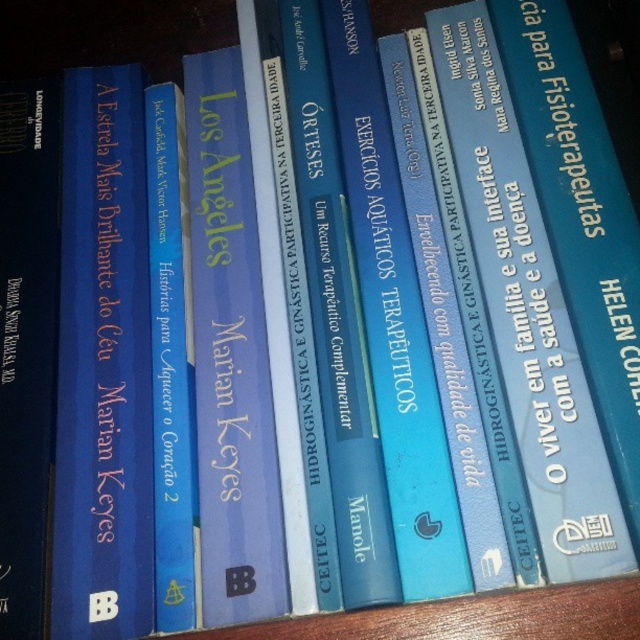
Question: Can you confirm if blue hardcover book at left is thinner than matte blue book at center?

Choices:
 (A) no
 (B) yes

Answer: (A)

Question: Which point is farther to the camera?

Choices:
 (A) (244, 580)
 (B) (100, 464)

Answer: (B)

Question: Is matte blue book at center behind blue hardcover book at center?

Choices:
 (A) yes
 (B) no

Answer: (A)

Question: Does blue hardcover book at left appear over blue hardcover book at center?

Choices:
 (A) no
 (B) yes

Answer: (A)

Question: Among these objects, which one is farthest from the camera?

Choices:
 (A) blue hardcover book at center
 (B) blue hardcover book at left
 (C) matte blue book at center

Answer: (B)

Question: Which of the following is the closest to the observer?

Choices:
 (A) blue hardcover book at left
 (B) matte blue book at center

Answer: (B)